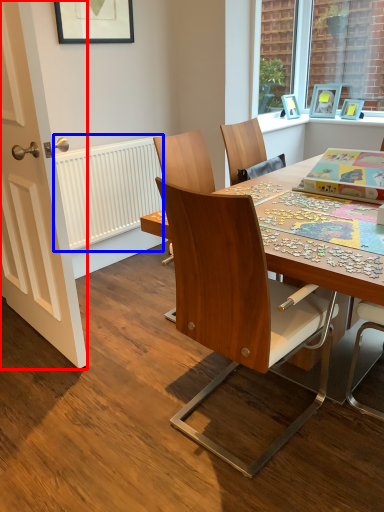
Question: Which point is closer to the camera, door (highlighted by a red box) or radiator (highlighted by a blue box)?

Choices:
 (A) door
 (B) radiator

Answer: (A)